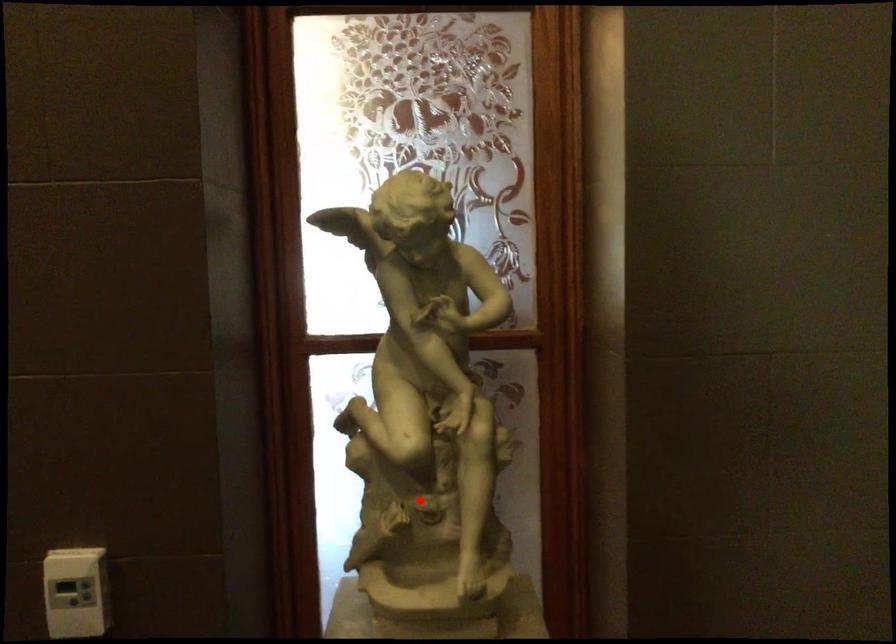
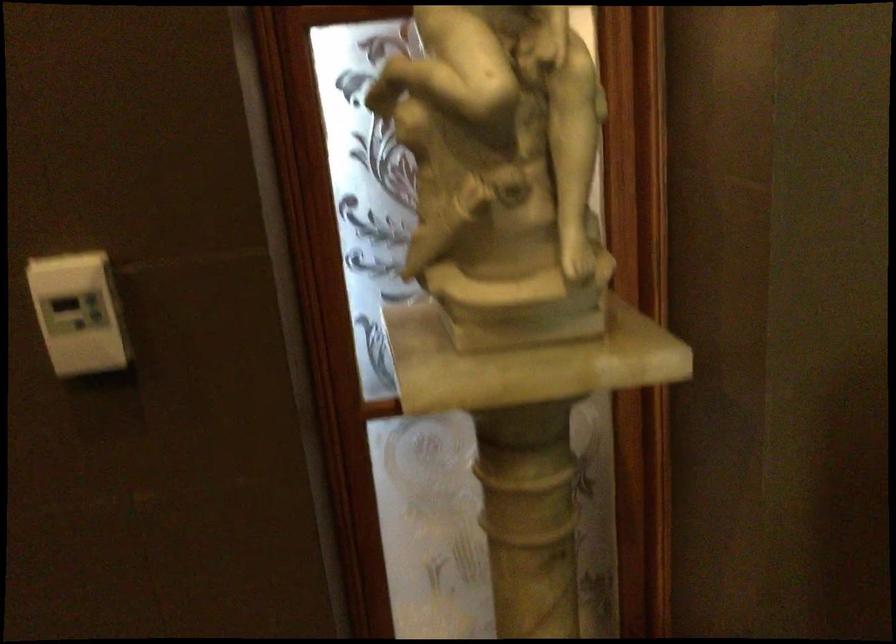
Where in the second image is the point corresponding to the highlighted location from the first image?

(502, 172)